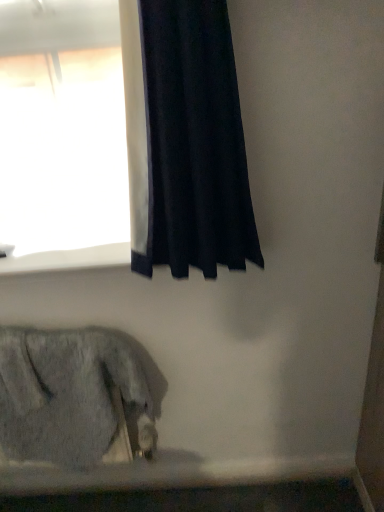
Question: Considering the relative positions of white smooth window sill at upper left and black velvet curtain at upper left in the image provided, is white smooth window sill at upper left to the left or to the right of black velvet curtain at upper left?

Choices:
 (A) left
 (B) right

Answer: (A)

Question: Is white smooth window sill at upper left in front of or behind black velvet curtain at upper left in the image?

Choices:
 (A) behind
 (B) front

Answer: (A)

Question: Estimate the real-world distances between objects in this image. Which object is farther from the fuzzy gray cat at lower left?

Choices:
 (A) black velvet curtain at upper left
 (B) white smooth window sill at upper left

Answer: (A)

Question: Estimate the real-world distances between objects in this image. Which object is closer to the black velvet curtain at upper left?

Choices:
 (A) white smooth window sill at upper left
 (B) fuzzy gray cat at lower left

Answer: (A)